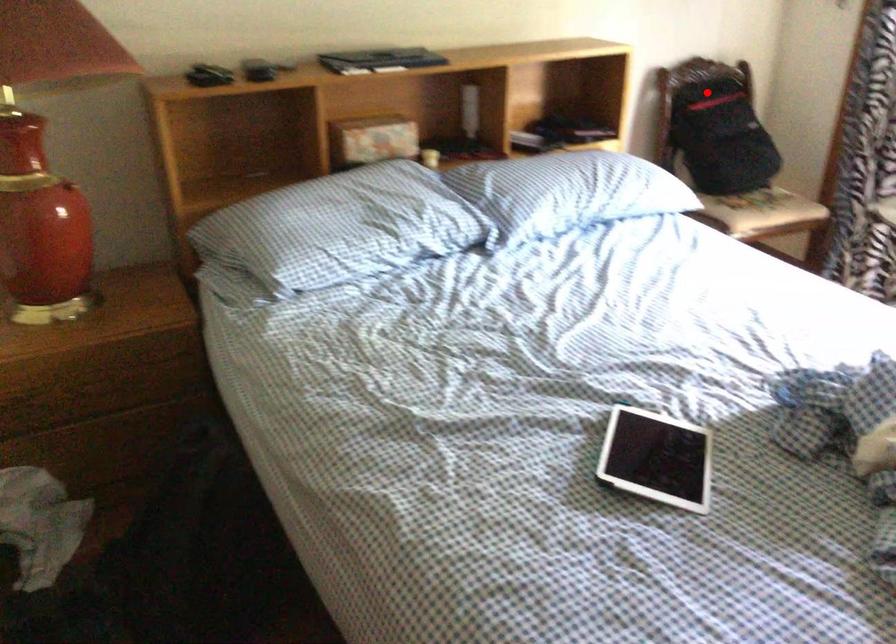
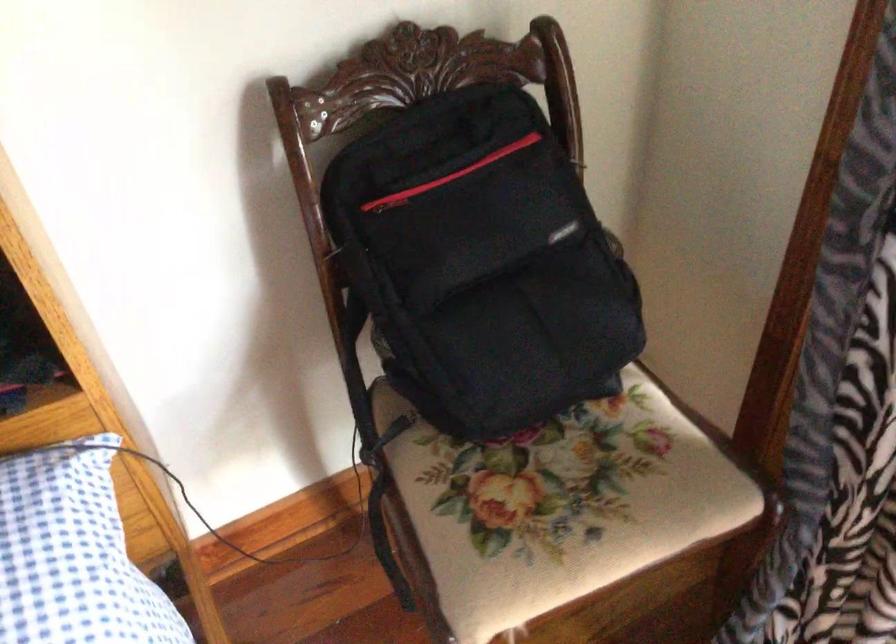
Where in the second image is the point corresponding to the highlighted location from the first image?

(389, 202)